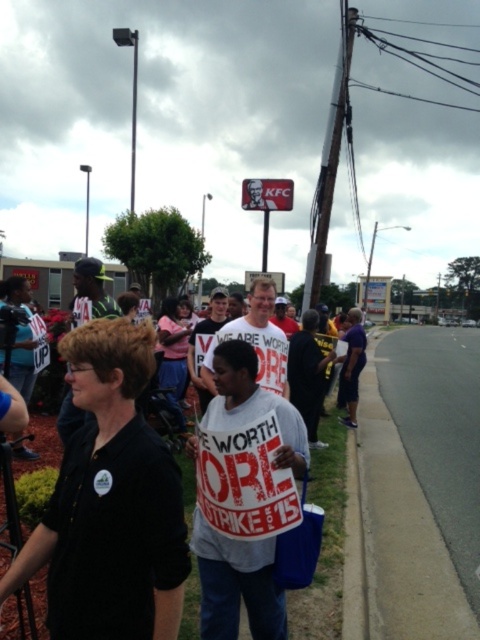
Question: Which object is positioned closest to the white cotton shirt at center?

Choices:
 (A) gray asphalt pavement at lower right
 (B) white paper sign at center
 (C) black shirt at center

Answer: (B)

Question: Which of the following is the closest to the observer?

Choices:
 (A) (241, 422)
 (B) (338, 433)

Answer: (A)

Question: Is black shirt at center closer to the viewer compared to white paper sign at center?

Choices:
 (A) no
 (B) yes

Answer: (B)

Question: Which point is farther to the camera?

Choices:
 (A) (207, 616)
 (B) (333, 605)

Answer: (B)

Question: Can you confirm if white paper sign at center is bigger than white cotton shirt at center?

Choices:
 (A) no
 (B) yes

Answer: (B)

Question: Considering the relative positions of black shirt at center and gray asphalt pavement at lower right in the image provided, where is black shirt at center located with respect to gray asphalt pavement at lower right?

Choices:
 (A) below
 (B) above

Answer: (B)